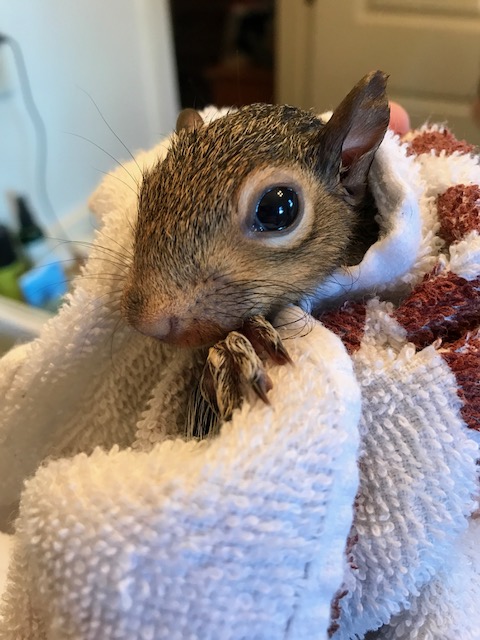
Locate an element on the screen. blanket is located at coordinates (316, 465).